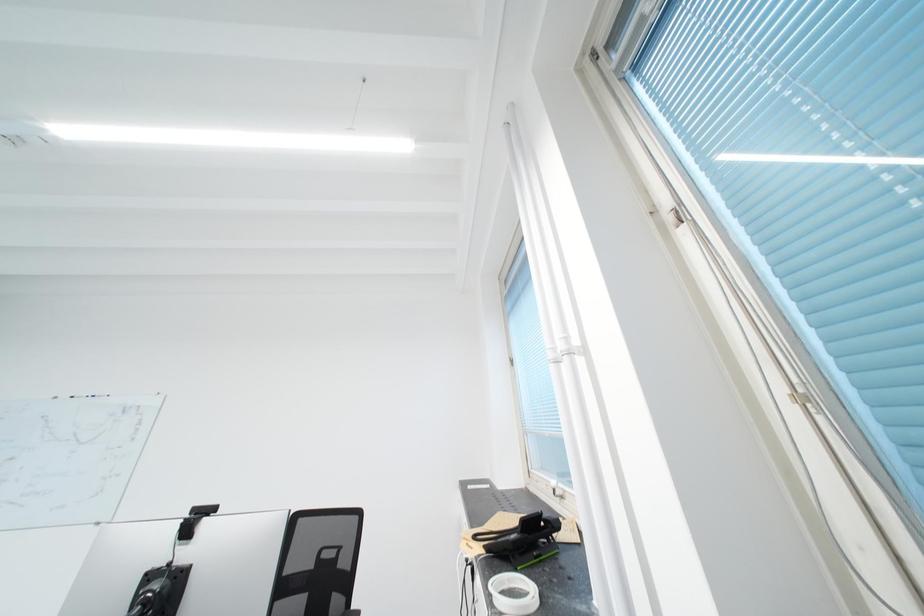
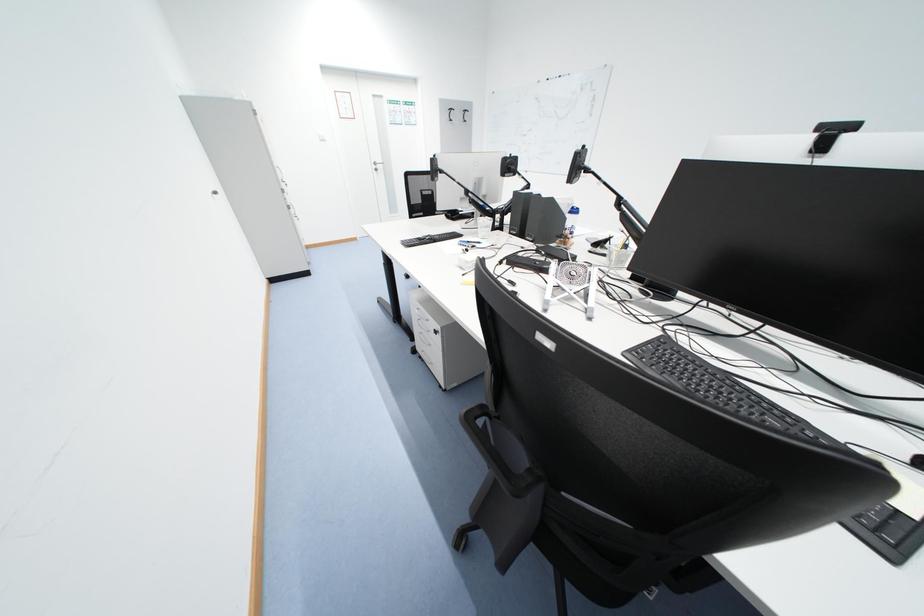
First-person continuous shooting, in which direction is the camera rotating?

The camera's rotation is toward left-down.